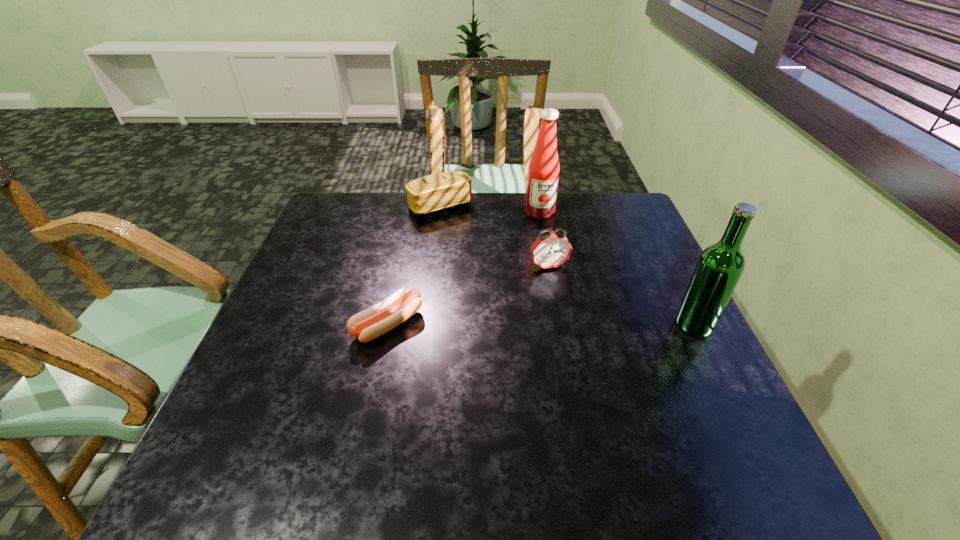
Where is `free spot on the desktop that is between the shortest object and the rightmost object and is positioned on the clock face of the third nearest object`? This screenshot has width=960, height=540. free spot on the desktop that is between the shortest object and the rightmost object and is positioned on the clock face of the third nearest object is located at coordinates (574, 324).

Find the location of a particular element. This screenshot has height=540, width=960. vacant space on the desktop that is between the sausage and the beer bottle and is positioned on the zipper side of the second shortest object is located at coordinates (522, 324).

Image resolution: width=960 pixels, height=540 pixels. I want to click on vacant space on the desktop that is between the shortest object and the beer bottle and is positioned on the front-facing side of the condiment, so click(575, 324).